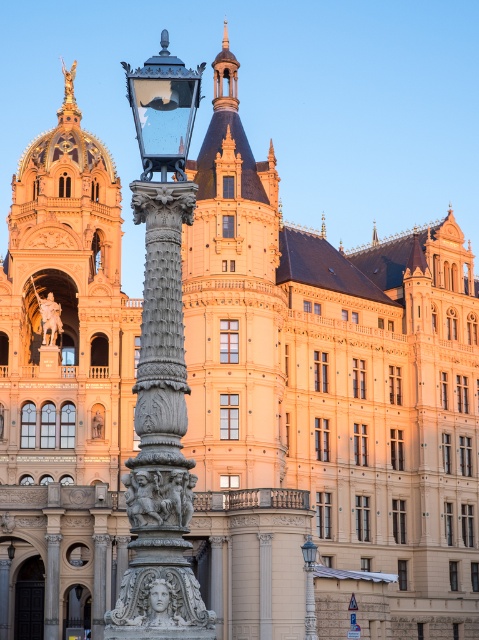
You are an architect visiting this building and need to install a new decorative element between the carved stone sculpture at center and the polished brass lantern at center. Which object should you place closer to the building to ensure the new element fits without overlapping either?

The carved stone sculpture at center is wider than the polished brass lantern at center. To avoid overlapping, place the new decorative element closer to the narrower polished brass lantern at center.

You are an architect assessing the proportions of the building and its elements. Given that both the polished bronze lamp post at center and the polished brass lantern at center are in the foreground, which one is taller?

The polished bronze lamp post at center is taller than the polished brass lantern at center.

You are standing in front of the grand building and want to take a photo. There are two points marked on your viewfinder at coordinates point [187,490] and point [311,624]. Which point is closer to your camera?

Point [187,490] is closer to the camera than point [311,624].